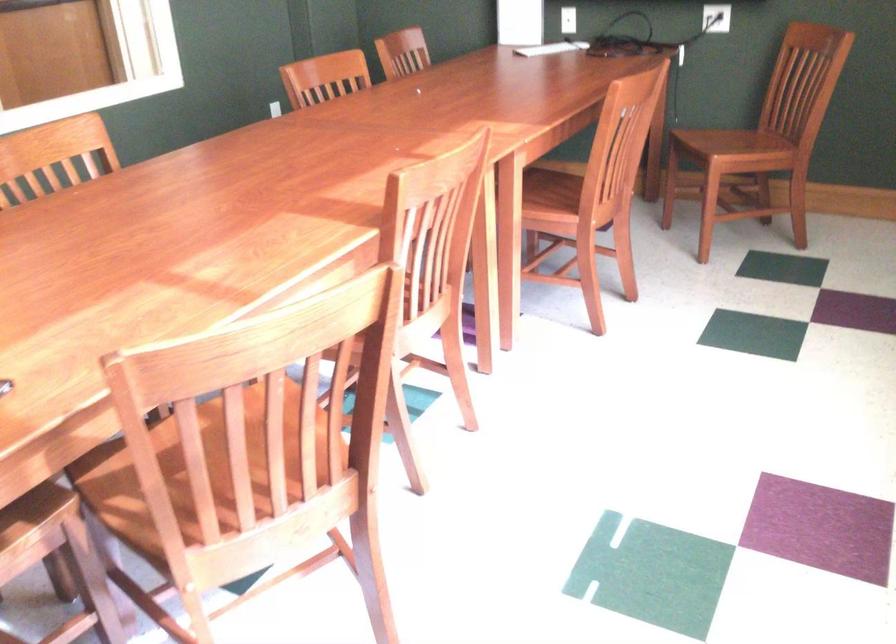
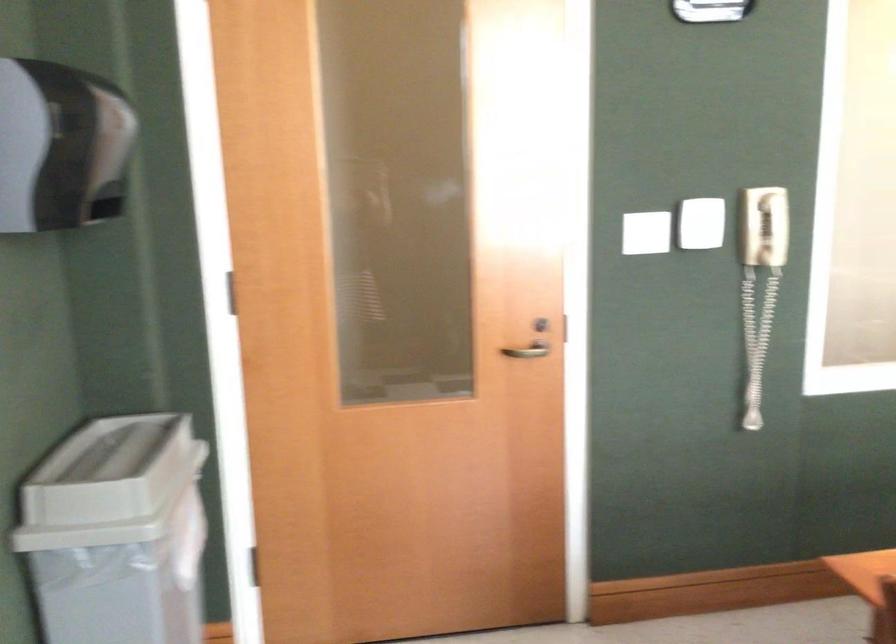
Question: The camera is either moving clockwise (left) or counter-clockwise (right) around the object. The first image is from the beginning of the video and the second image is from the end. Is the camera moving left or right when shooting the video?

Choices:
 (A) Left
 (B) Right

Answer: (B)